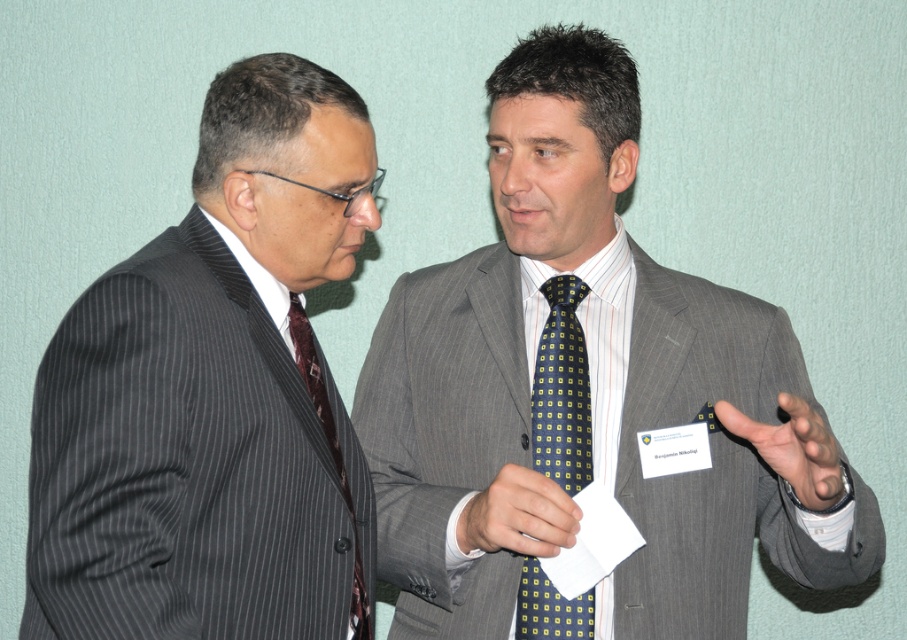
Question: Which of the following is the farthest from the observer?

Choices:
 (A) yellow dotted tie at center
 (B) matte black suit at left

Answer: (A)

Question: From the image, what is the correct spatial relationship of yellow-green dotted tie at center in relation to yellow dotted tie at center?

Choices:
 (A) left
 (B) right

Answer: (B)

Question: Is the position of gray pinstripe suit at center less distant than that of yellow dotted tie at center?

Choices:
 (A) no
 (B) yes

Answer: (B)

Question: Does yellow-green dotted tie at center lie in front of matte yellow tie at right?

Choices:
 (A) yes
 (B) no

Answer: (B)

Question: Which object is farther from the camera taking this photo?

Choices:
 (A) gray pinstripe suit at center
 (B) yellow-green dotted tie at center
 (C) matte yellow tie at right

Answer: (B)

Question: Which object appears closest to the camera in this image?

Choices:
 (A) gray pinstripe suit at center
 (B) matte black suit at left
 (C) yellow-green dotted tie at center
 (D) maroon silk tie at left

Answer: (B)